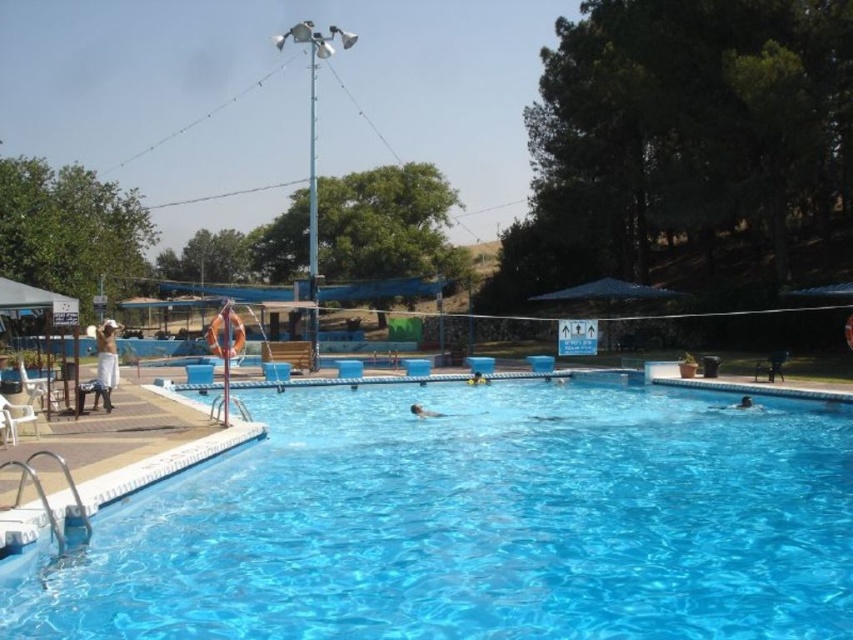
You are a swimmer trying to locate your position relative to the transparent blue water at center and the smooth blue swimmer at center. Since you see both objects in the image, which one is above the other?

The smooth blue swimmer at center is above the transparent blue water at center because the swimmer is positioned over the water.

You are a swimmer trying to stay within the pool area. Given the transparent blue water at center and the smooth blue swimmer at center, which one is wider?

The transparent blue water at center is wider than the smooth blue swimmer at center.

In the scene shown: You are standing at the edge of the pool and want to throw a ball to a friend. The ball must pass over two specific points marked as point 1 and point 2. Point 1 is at coordinates point (105, 404) and point 2 is at point (473, 384). Based on the image, which point should you aim for first to ensure the ball passes both points in order?

You should aim for point (105, 404) first because it is closer to you than point (473, 384). Since the ball travels in a straight path, you need to reach the closer point before the farther one.